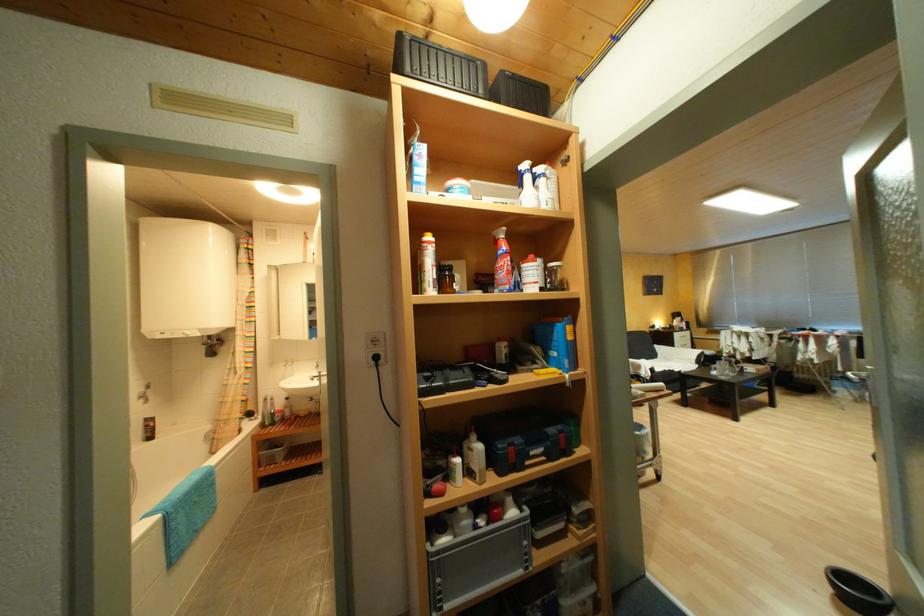
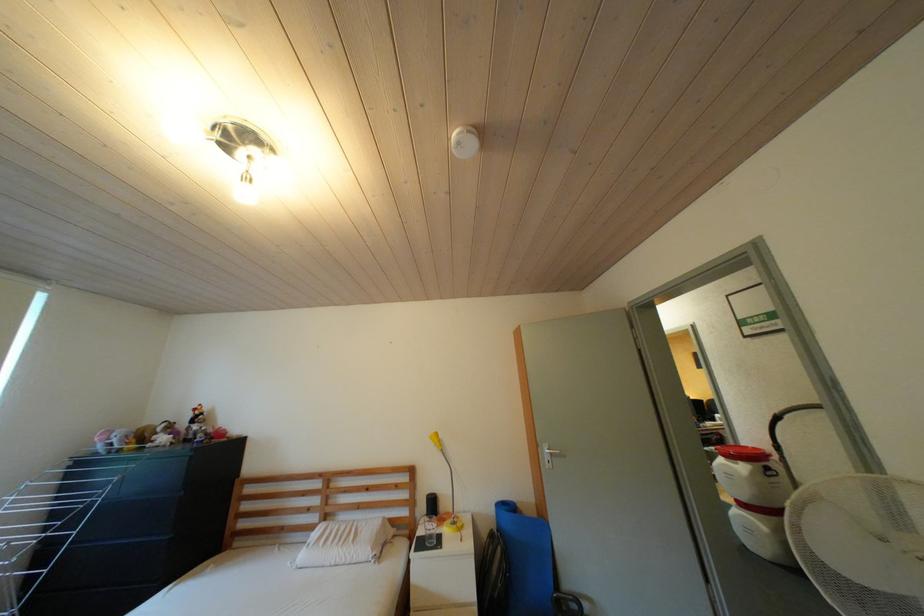
Question: I am providing you with two images of the same scene from different viewpoints. Please identify which objects are invisible in image2.

Choices:
 (A) silver door handle
 (B) sofa sitting surface
 (C) red container lid
 (D) small lid knob

Answer: (B)